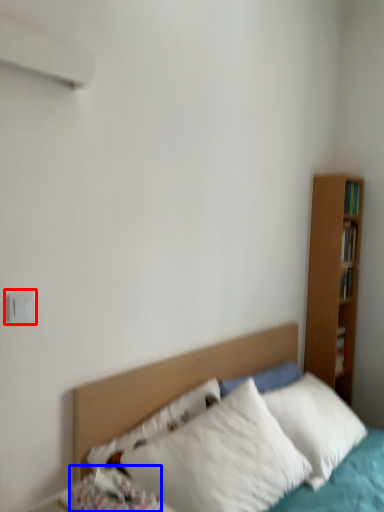
Question: Which point is further to the camera, electric outlet (highlighted by a red box) or pillow (highlighted by a blue box)?

Choices:
 (A) electric outlet
 (B) pillow

Answer: (A)